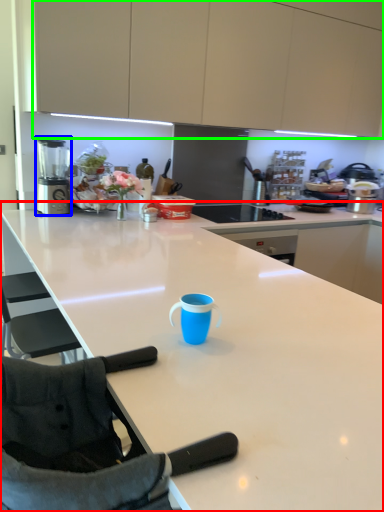
Question: Considering the real-world distances, which object is closest to countertop (highlighted by a red box)? blender (highlighted by a blue box) or cabinetry (highlighted by a green box).

Choices:
 (A) blender
 (B) cabinetry

Answer: (A)